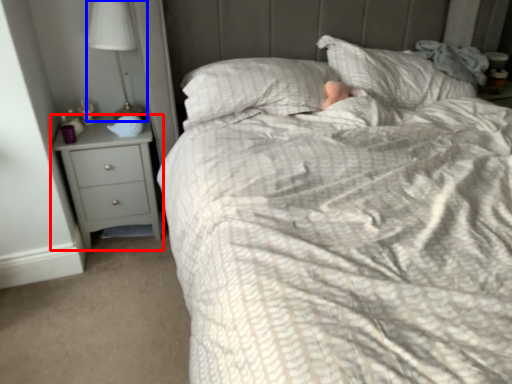
Question: Which of the following is the farthest to the observer, chest of drawers (highlighted by a red box) or lamp (highlighted by a blue box)?

Choices:
 (A) chest of drawers
 (B) lamp

Answer: (A)